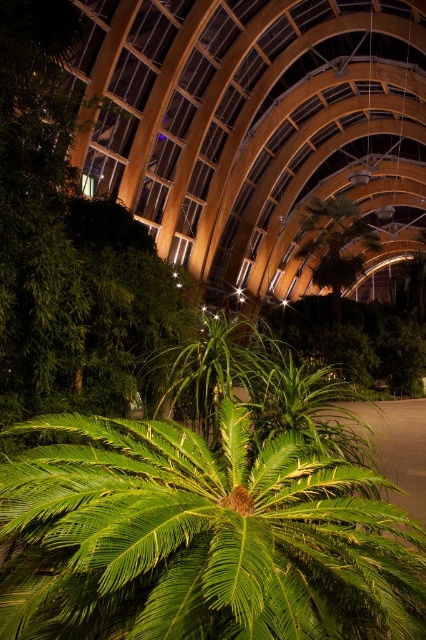
Question: Observing the image, what is the correct spatial positioning of green leafy palm tree at center in reference to green leafy plant at center?

Choices:
 (A) above
 (B) below

Answer: (B)

Question: Does green leafy palm tree at center come in front of green leafy plant at center?

Choices:
 (A) yes
 (B) no

Answer: (A)

Question: Is green leafy palm tree at center below green leafy plant at center?

Choices:
 (A) no
 (B) yes

Answer: (B)

Question: Which of the following is the farthest from the observer?

Choices:
 (A) green leafy palm tree at center
 (B) green leafy plant at center

Answer: (B)